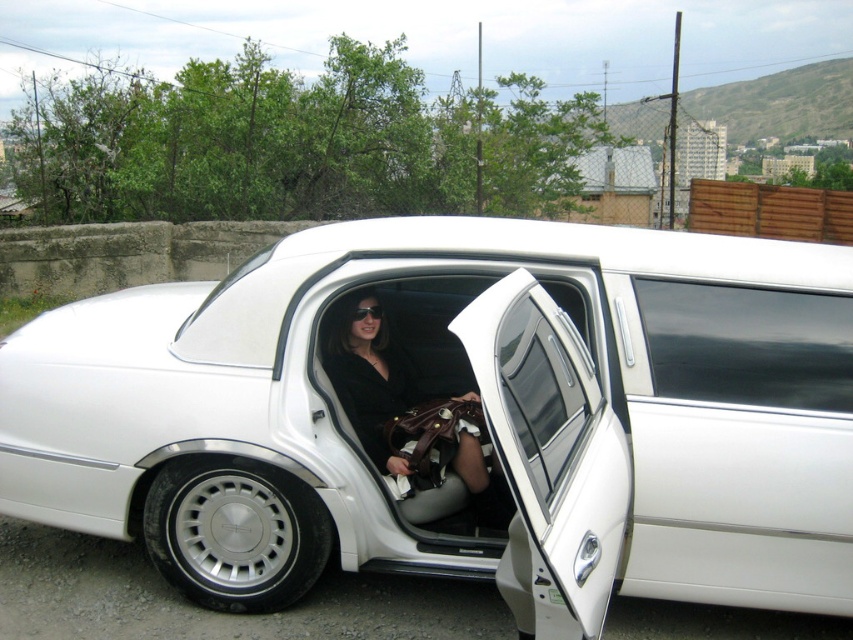
Between white glossy door at center and black leather handbag at center, which one is positioned lower?

white glossy door at center is lower down.

Who is higher up, white glossy door at center or black leather handbag at center?

Positioned higher is black leather handbag at center.

Describe the element at coordinates (549, 458) in the screenshot. I see `white glossy door at center` at that location.

This screenshot has height=640, width=853. Identify the location of white glossy door at center. (x=549, y=458).

Who is higher up, white glossy limousine at center or black leather handbag at center?

white glossy limousine at center is higher up.

Who is lower down, white glossy limousine at center or black leather handbag at center?

black leather handbag at center

At what (x,y) coordinates should I click in order to perform the action: click on white glossy limousine at center. Please return your answer as a coordinate pair (x, y). This screenshot has height=640, width=853. Looking at the image, I should click on (456, 394).

The height and width of the screenshot is (640, 853). I want to click on white glossy limousine at center, so click(x=456, y=394).

Is point (689, 525) positioned in front of point (488, 346)?

No, (689, 525) is further to viewer.

Does point (140, 385) come behind point (517, 572)?

Yes.

Find the location of a particular element. white glossy limousine at center is located at coordinates (456, 394).